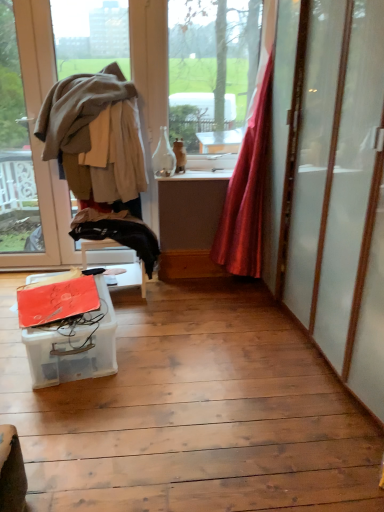
Question: Does translucent plastic container at lower left have a lesser width compared to silky red curtain at right?

Choices:
 (A) yes
 (B) no

Answer: (B)

Question: Can silky red curtain at right be found inside translucent plastic container at lower left?

Choices:
 (A) yes
 (B) no

Answer: (B)

Question: Is translucent plastic container at lower left aimed at silky red curtain at right?

Choices:
 (A) yes
 (B) no

Answer: (B)

Question: Does translucent plastic container at lower left appear on the left side of silky red curtain at right?

Choices:
 (A) yes
 (B) no

Answer: (A)

Question: Is translucent plastic container at lower left turned away from silky red curtain at right?

Choices:
 (A) no
 (B) yes

Answer: (A)

Question: From the image's perspective, relative to translucent plastic container at lower left, is matte beige window at left above or below?

Choices:
 (A) above
 (B) below

Answer: (A)

Question: In terms of height, does matte beige window at left look taller or shorter compared to translucent plastic container at lower left?

Choices:
 (A) short
 (B) tall

Answer: (B)

Question: Is point [43, 68] closer or farther from the camera than point [104, 289]?

Choices:
 (A) closer
 (B) farther

Answer: (B)

Question: Visually, is matte beige window at left positioned to the left or to the right of translucent plastic container at lower left?

Choices:
 (A) left
 (B) right

Answer: (A)

Question: Is translucent plastic container at lower left spatially inside silky red curtain at right, or outside of it?

Choices:
 (A) inside
 (B) outside

Answer: (B)

Question: In terms of size, does translucent plastic container at lower left appear bigger or smaller than silky red curtain at right?

Choices:
 (A) small
 (B) big

Answer: (A)

Question: Is translucent plastic container at lower left in front of or behind silky red curtain at right in the image?

Choices:
 (A) behind
 (B) front

Answer: (B)

Question: Does point (87, 331) appear closer or farther from the camera than point (268, 79)?

Choices:
 (A) closer
 (B) farther

Answer: (A)

Question: Considering the positions of translucent plastic container at lower left and light brown fabric at left in the image, is translucent plastic container at lower left bigger or smaller than light brown fabric at left?

Choices:
 (A) small
 (B) big

Answer: (A)

Question: Which is correct: translucent plastic container at lower left is inside light brown fabric at left, or outside of it?

Choices:
 (A) inside
 (B) outside

Answer: (B)